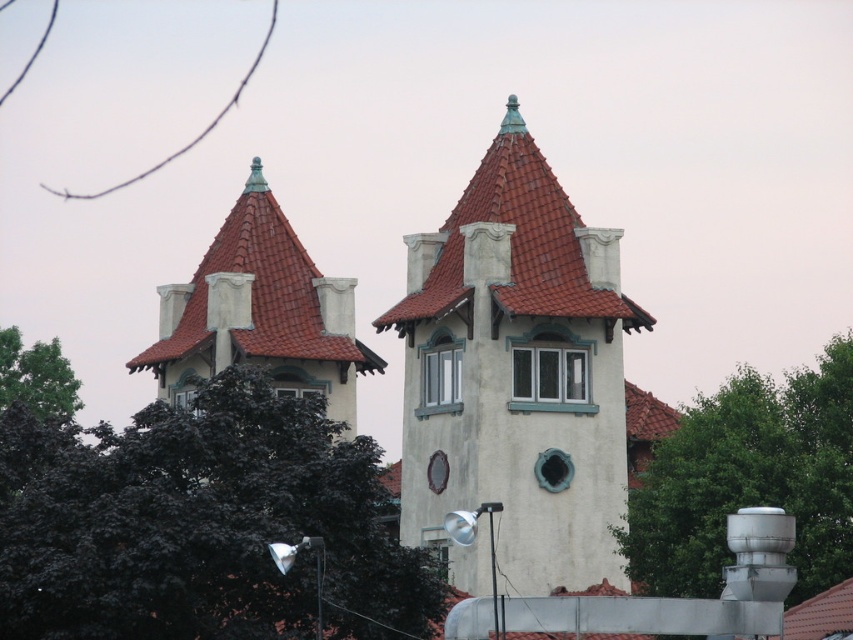
This screenshot has height=640, width=853. What do you see at coordinates (193, 518) in the screenshot?
I see `dark green leaves at upper left` at bounding box center [193, 518].

How far apart are dark green leaves at upper left and matte white tower at upper left?

10.28 meters

Between point (361, 582) and point (228, 273), which one is positioned in front?

Point (361, 582) is more forward.

Where is `dark green leaves at upper left`? The height and width of the screenshot is (640, 853). dark green leaves at upper left is located at coordinates [193, 518].

Which of these two, smooth white tower at center or matte white tower at upper left, stands shorter?

matte white tower at upper left

Which is behind, point (467, 189) or point (207, 365)?

Point (207, 365)

Where is `smooth white tower at center`? Image resolution: width=853 pixels, height=640 pixels. smooth white tower at center is located at coordinates (518, 376).

Is smooth white tower at center in front of green leafy tree at left?

Yes, it is in front of green leafy tree at left.

Between point (567, 500) and point (32, 352), which one is positioned in front?

Point (567, 500) is more forward.

Locate an element on the screen. The width and height of the screenshot is (853, 640). smooth white tower at center is located at coordinates (518, 376).

The height and width of the screenshot is (640, 853). What are the coordinates of `smooth white tower at center` in the screenshot? It's located at click(518, 376).